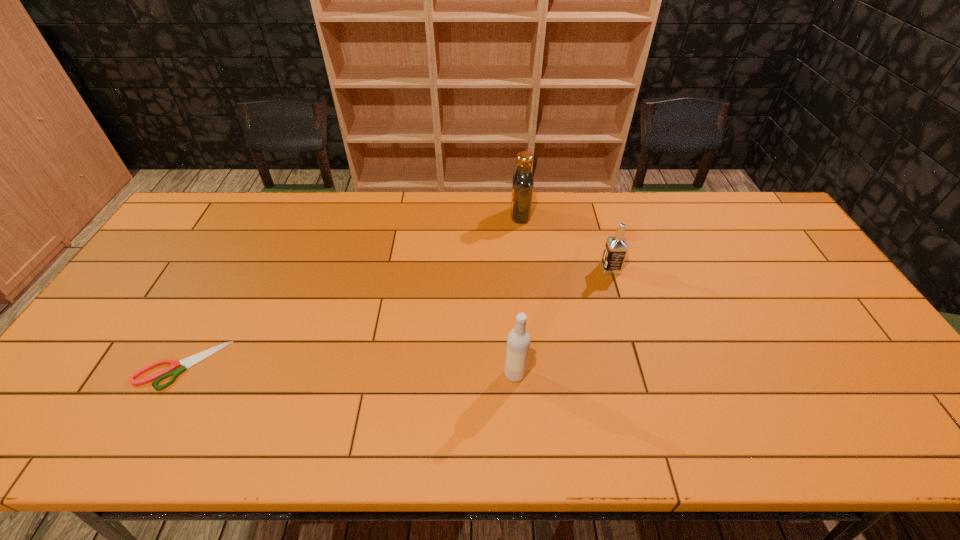
Identify which object is the closest to the nearest vodka. Please provide its 2D coordinates. Your answer should be formatted as a tuple, i.e. [(x, y)], where the tuple contains the x and y coordinates of a point satisfying the conditions above.

[(616, 247)]

Locate an element on the screen. vodka that is the closest to the farthest object is located at coordinates (616, 247).

The width and height of the screenshot is (960, 540). Identify the location of the closest vodka to the nearest vodka. (616, 247).

In order to click on vacant space that satisfies the following two spatial constraints: 1. on the front label of the rightmost object; 2. on the front side of the leftmost object in this screenshot , I will do `click(639, 365)`.

You are a GUI agent. You are given a task and a screenshot of the screen. Output one action in this format:
    pyautogui.click(x=<x>, y=<y>)
    Task: Click on the free space that satisfies the following two spatial constraints: 1. on the front side of the scissors; 2. on the right side of the nearest vodka
    This screenshot has width=960, height=540.
    Given the screenshot: What is the action you would take?
    pyautogui.click(x=177, y=374)

Where is `free space in the image that satisfies the following two spatial constraints: 1. on the front-facing side of the farthest vodka; 2. on the front side of the nearest vodka`? free space in the image that satisfies the following two spatial constraints: 1. on the front-facing side of the farthest vodka; 2. on the front side of the nearest vodka is located at coordinates (537, 374).

Find the location of a particular element. vacant area in the image that satisfies the following two spatial constraints: 1. on the front-facing side of the farthest object; 2. on the front side of the scissors is located at coordinates (536, 365).